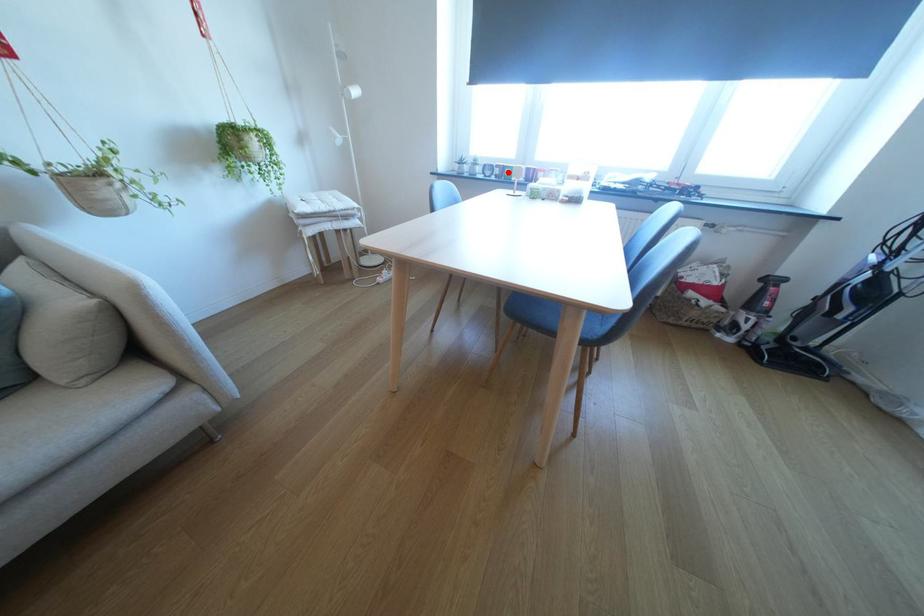
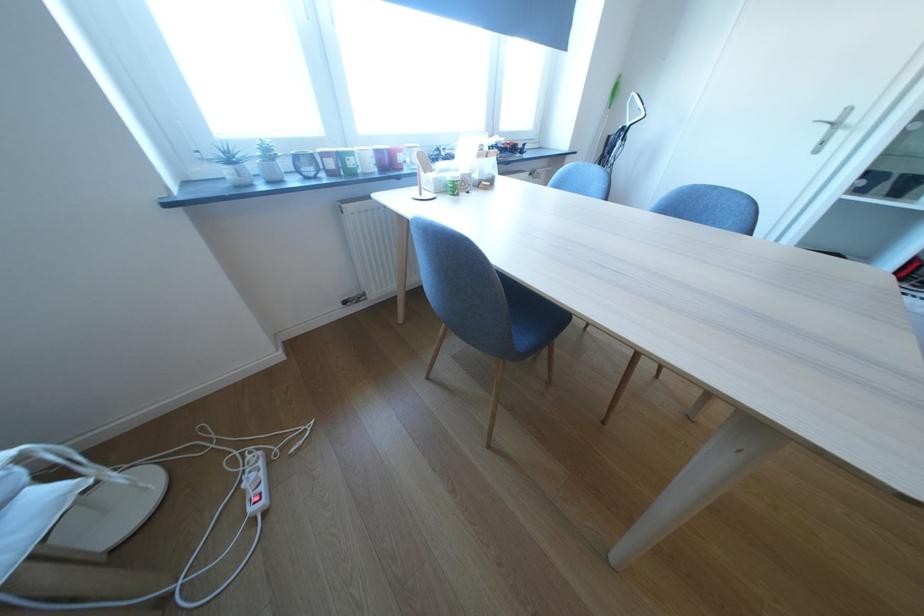
Question: I am providing you with two images of the same scene from different viewpoints. Image1 has a red point marked. In image2, the corresponding 3D location appears at what relative position? Reply with the corresponding letter.

Choices:
 (A) Closer
 (B) Farther

Answer: (B)